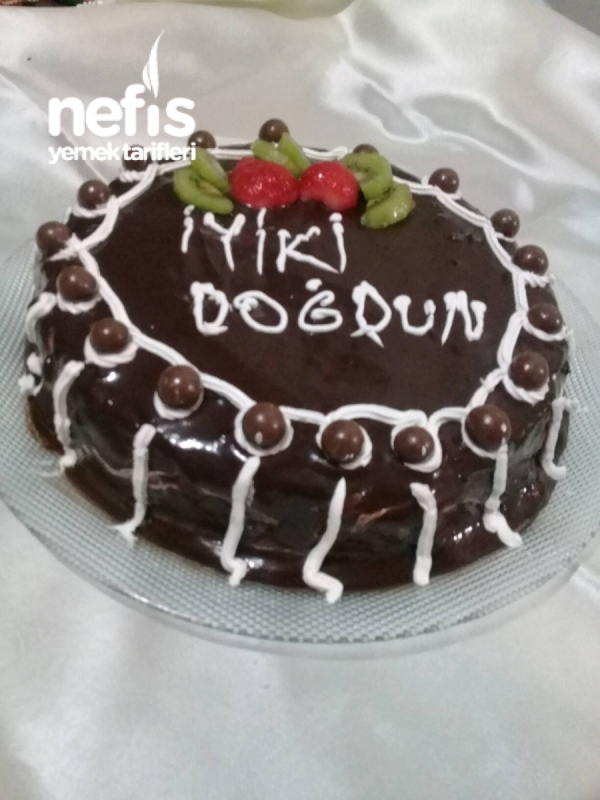
Find the location of `plate`. plate is located at coordinates (226, 610).